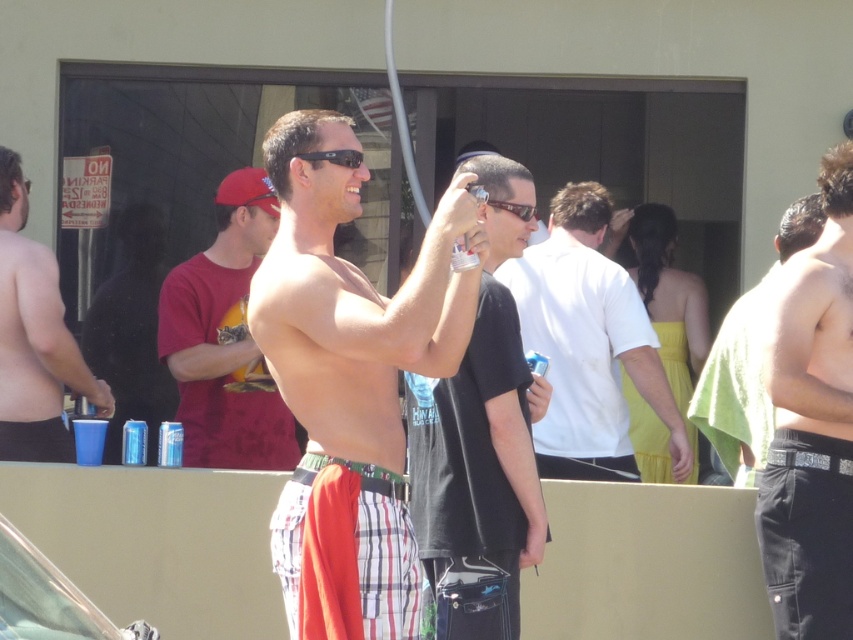
You are standing at the point labeled as point (257, 464) and want to throw a frisbee to someone exactly 20 feet away. Can you reach them?

The distance between you and the target is 21.52 feet, which is more than 20 feet. Therefore, you cannot reach them with a 20 feet throw.

You are standing at the point with coordinates (350, 381) in the image. What object are you currently standing on?

The point at (350, 381) is on the plaid shorts at center, so you are standing on the plaid shorts at center.